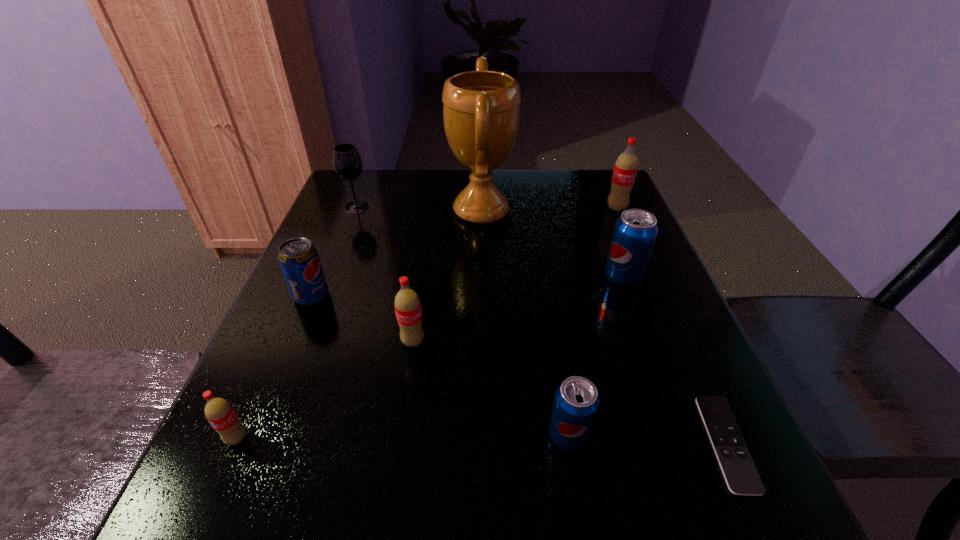
The image size is (960, 540). Find the location of `remote control that is at the right edge`. remote control that is at the right edge is located at coordinates [742, 478].

Identify the location of object that is at the far left corner. The image size is (960, 540). (347, 163).

Identify the location of object present at the far right corner. (625, 169).

I want to click on object situated at the near right corner, so click(x=742, y=478).

Identify the location of free point at the far edge. (564, 197).

This screenshot has height=540, width=960. Find the location of `vacant space at the near edge of the desktop`. vacant space at the near edge of the desktop is located at coordinates (478, 502).

Image resolution: width=960 pixels, height=540 pixels. I want to click on vacant space at the left edge of the desktop, so click(x=330, y=394).

In the image, there is a desktop. At what (x,y) coordinates should I click in order to perform the action: click on free region at the right edge. Please return your answer as a coordinate pair (x, y). Looking at the image, I should click on (677, 411).

The width and height of the screenshot is (960, 540). In the image, there is a desktop. Identify the location of free space at the near left corner. (202, 486).

This screenshot has width=960, height=540. I want to click on vacant space at the far right corner, so click(580, 183).